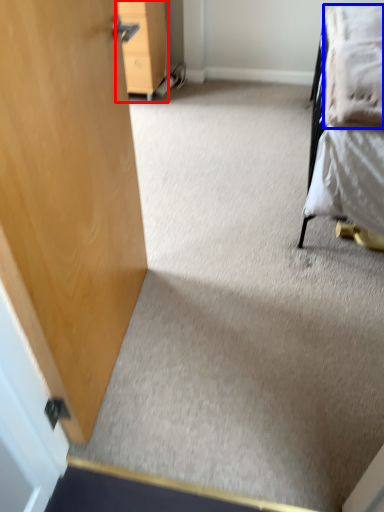
Question: Which object appears closest to the camera in this image, furniture (highlighted by a red box) or blanket (highlighted by a blue box)?

Choices:
 (A) furniture
 (B) blanket

Answer: (B)